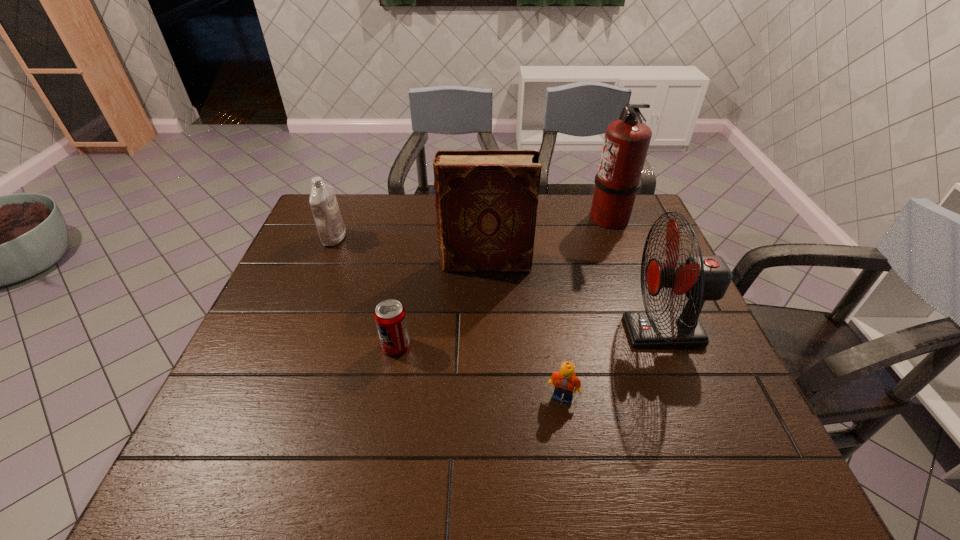
What are the coordinates of `detergent that is positioned at the far edge` in the screenshot? It's located at pyautogui.click(x=331, y=228).

Locate an element on the screen. The width and height of the screenshot is (960, 540). object located at the left edge is located at coordinates (331, 228).

Identify the location of fire extinguisher that is at the right edge. click(626, 142).

The width and height of the screenshot is (960, 540). Identify the location of fan that is at the right edge. (702, 278).

Where is `object present at the far left corner`? This screenshot has height=540, width=960. object present at the far left corner is located at coordinates (331, 228).

Find the location of a particular element. The image size is (960, 540). object positioned at the far right corner is located at coordinates (626, 142).

In the image, there is a desktop. Identify the location of vacant space at the far edge. This screenshot has height=540, width=960. (588, 217).

Image resolution: width=960 pixels, height=540 pixels. I want to click on vacant space at the near edge of the desktop, so click(x=371, y=482).

Where is `vacant space at the left edge of the desktop`? The height and width of the screenshot is (540, 960). vacant space at the left edge of the desktop is located at coordinates tap(307, 284).

Identify the location of free space at the right edge of the desktop. (726, 400).